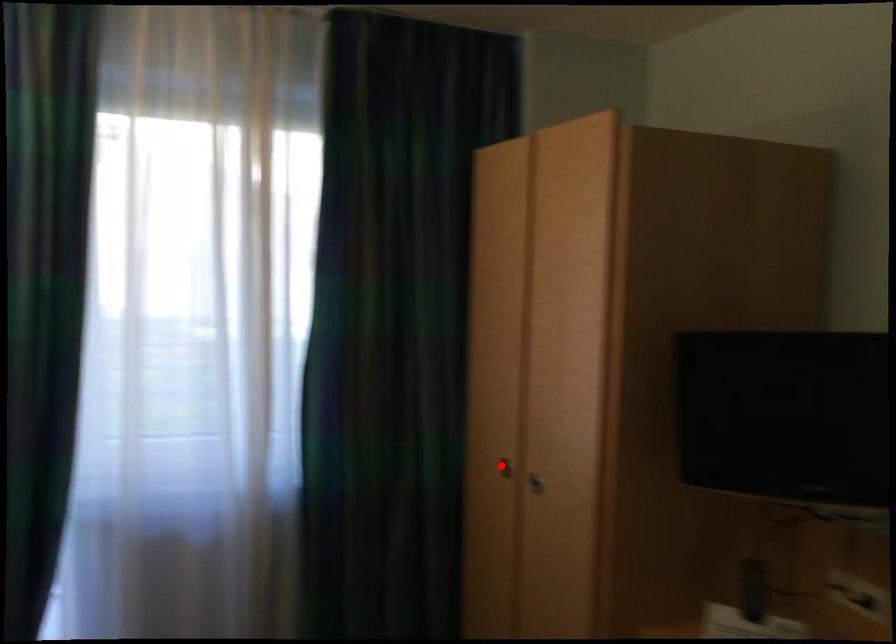
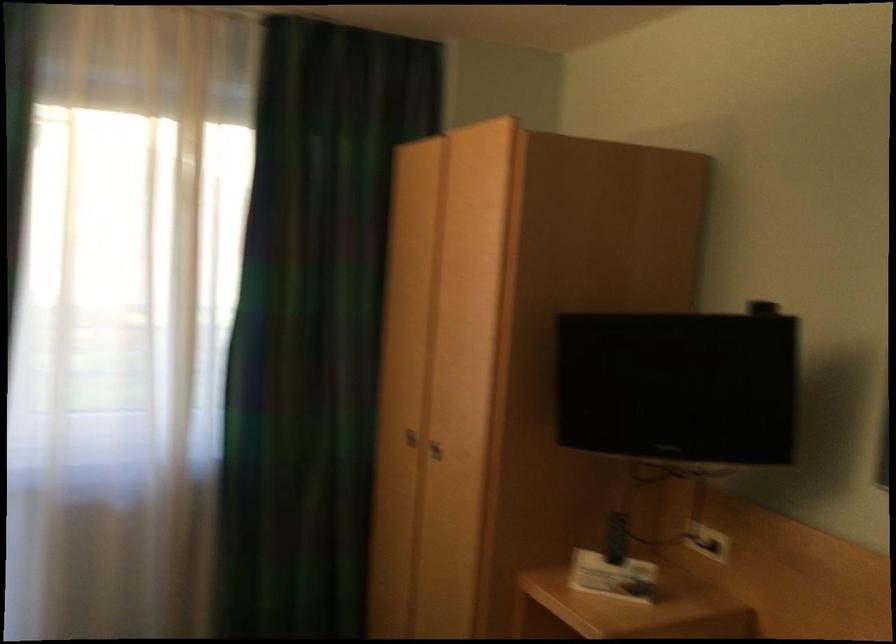
The point at the highlighted location is marked in the first image. Where is the corresponding point in the second image?

(409, 438)